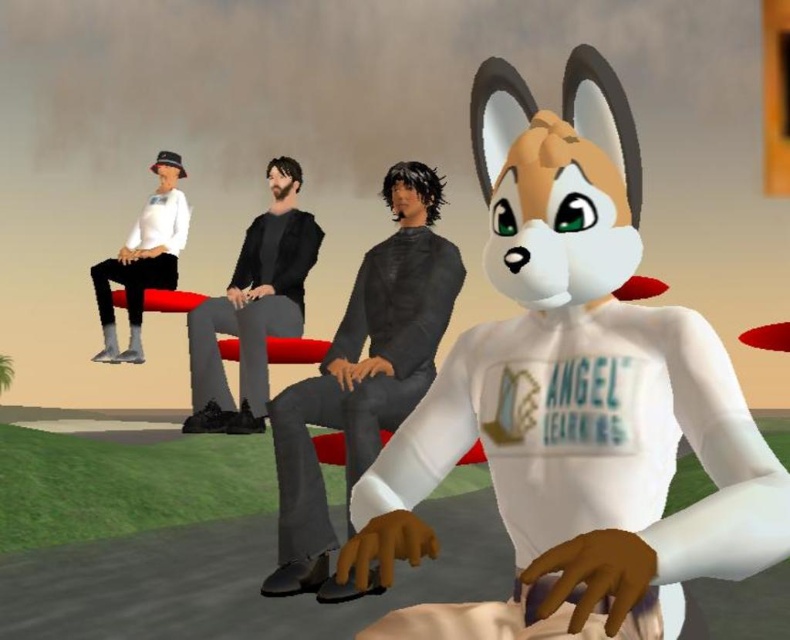
Looking at this image, you are a photographer trying to capture the best shot of the scene. You notice two points in the image at coordinates point (x=641, y=609) and point (x=279, y=563). Which point is closer to your camera lens?

Point (x=641, y=609) is closer to the camera lens than point (x=279, y=563).

Based on the photo, you are designing a display for a toy store and need to arrange the white matte plush at center and the dark gray hoodie at center so that the shorter item is placed on the lower shelf. Which item should go on the lower shelf?

The white matte plush at center is shorter than the dark gray hoodie at center, so it should be placed on the lower shelf.